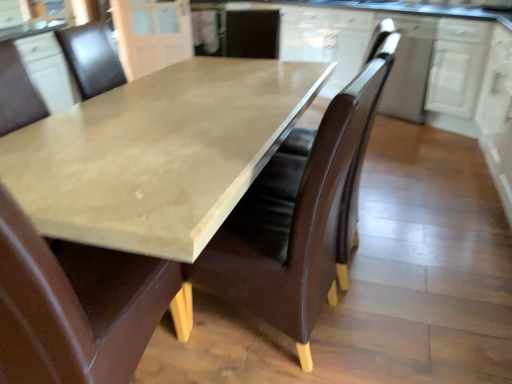
Locate an element on the screen. Image resolution: width=512 pixels, height=384 pixels. empty space that is in between brown leather swivel chair at center and white glossy cabinet at upper right, which is counted as the fourth cabinetry, starting from the left is located at coordinates (416, 183).